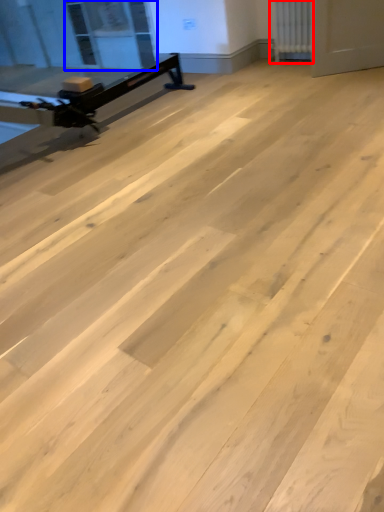
Question: Which object is further to the camera taking this photo, radiator (highlighted by a red box) or window screen (highlighted by a blue box)?

Choices:
 (A) radiator
 (B) window screen

Answer: (B)